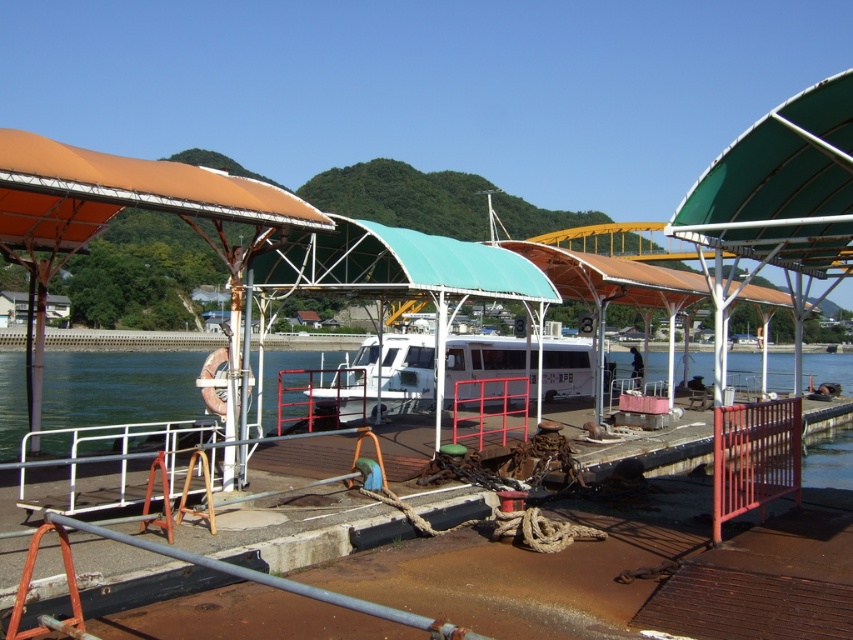
Question: Can you confirm if clear water at lower left is thinner than white matte boat at center?

Choices:
 (A) yes
 (B) no

Answer: (B)

Question: Is clear water at lower left closer to camera compared to white matte boat at center?

Choices:
 (A) no
 (B) yes

Answer: (B)

Question: Which of the following is the closest to the observer?

Choices:
 (A) white matte boat at center
 (B) clear water at lower left

Answer: (B)

Question: Among these points, which one is nearest to the camera?

Choices:
 (A) (399, 387)
 (B) (181, 358)

Answer: (A)

Question: Does clear water at lower left appear on the right side of white matte boat at center?

Choices:
 (A) yes
 (B) no

Answer: (B)